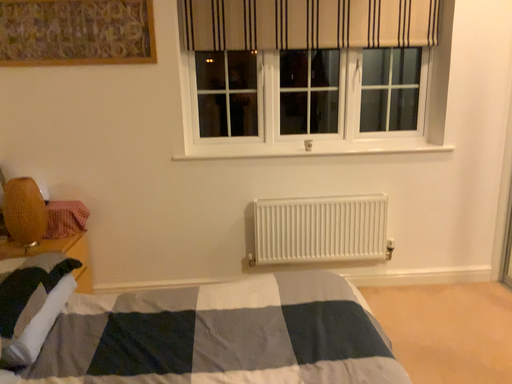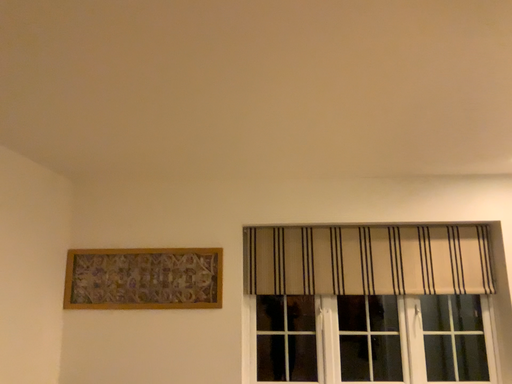
Question: How did the camera likely rotate when shooting the video?

Choices:
 (A) rotated upward
 (B) rotated downward

Answer: (A)